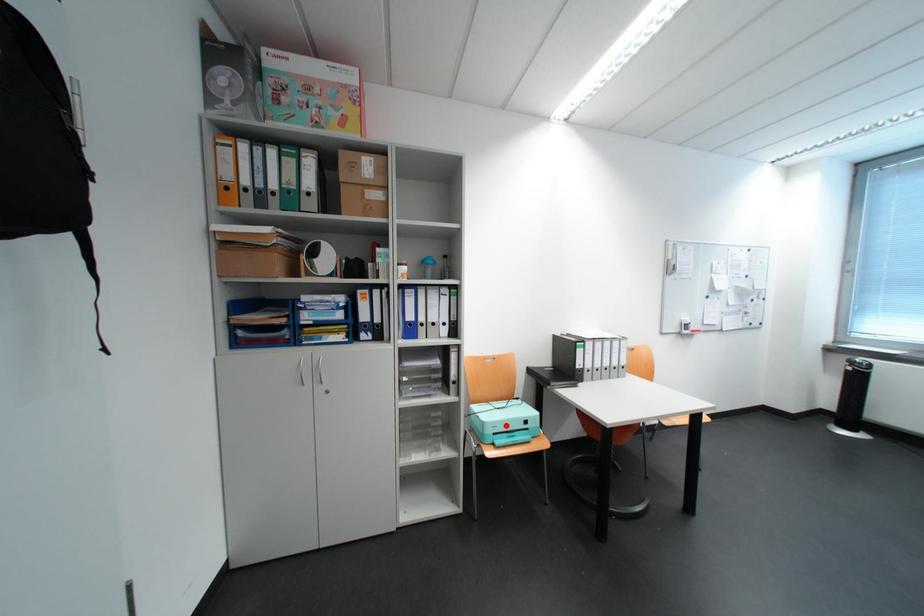
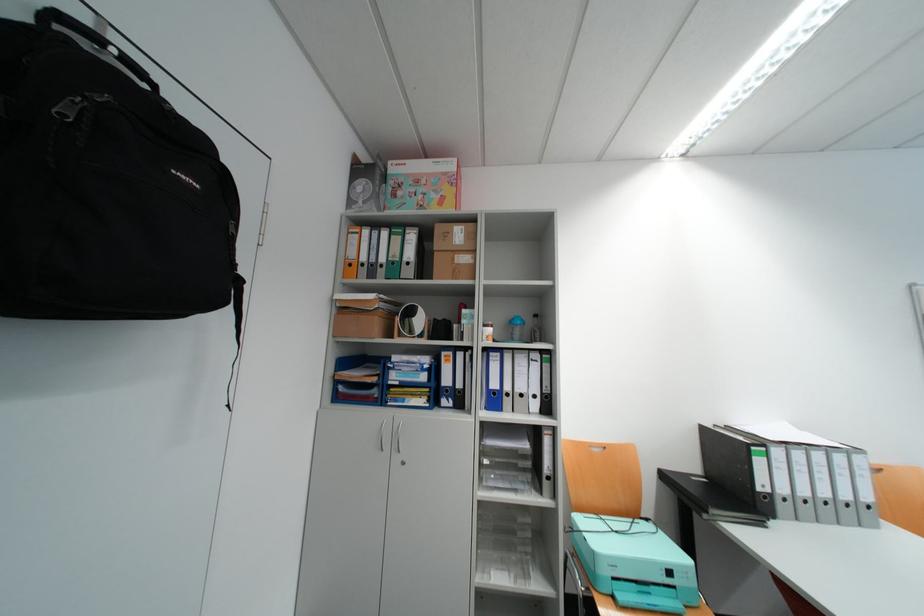
In the second image, find the point that corresponds to the highlighted location in the first image.

(624, 562)